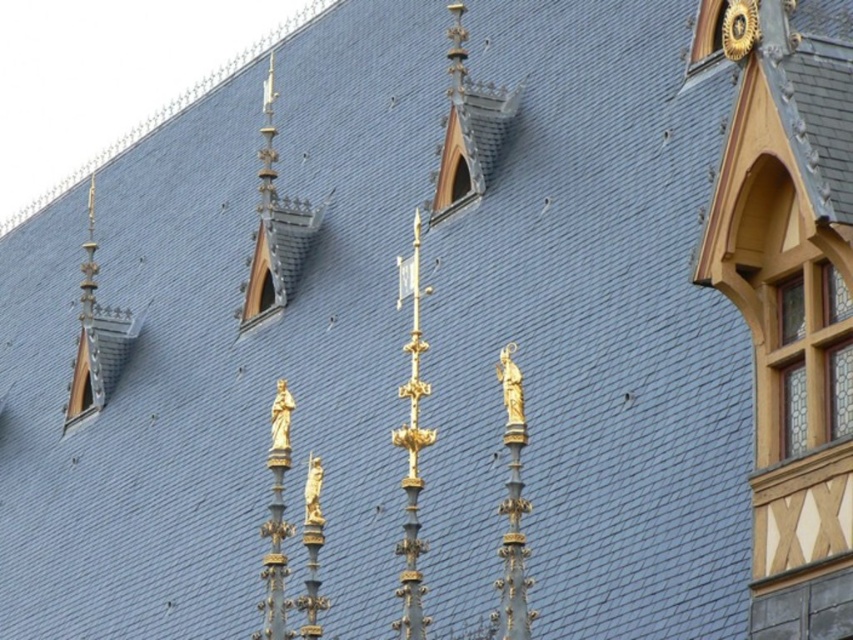
Question: Which object is closer to the camera taking this photo?

Choices:
 (A) stained glass window at upper right
 (B) clear glass window at upper center
 (C) transparent glass window at upper center

Answer: (A)

Question: Which is farther from the transparent glass window at upper center?

Choices:
 (A) clear glass window at upper center
 (B) gold metallic clock at upper right
 (C) stained glass window at upper right

Answer: (C)

Question: Does stained glass window at upper right have a smaller size compared to transparent glass window at upper center?

Choices:
 (A) yes
 (B) no

Answer: (A)

Question: Is stained glass window at upper right further to the viewer compared to gold metallic clock at upper right?

Choices:
 (A) no
 (B) yes

Answer: (A)

Question: From the image, what is the correct spatial relationship of stained glass window at upper right in relation to clear glass window at upper center?

Choices:
 (A) above
 (B) below

Answer: (B)

Question: Considering the real-world distances, which object is closest to the gold metallic clock at upper right?

Choices:
 (A) clear glass window at upper center
 (B) stained glass window at upper right

Answer: (B)